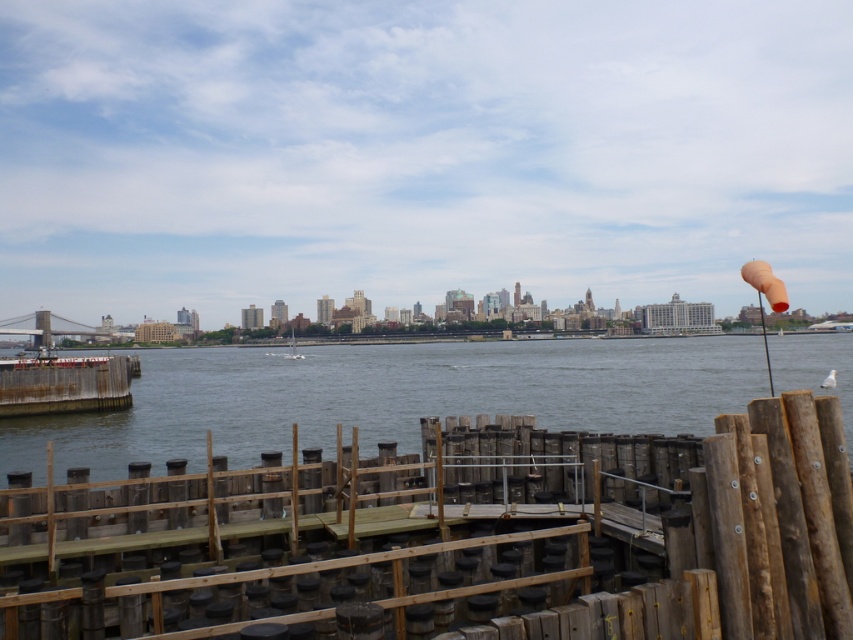
Question: Estimate the real-world distances between objects in this image. Which object is farther from the brown wooden fence at lower center?

Choices:
 (A) white matte sailboat at center
 (B) gray water at lower left

Answer: (A)

Question: Is the position of brown wooden fence at lower center less distant than that of gray water at lower left?

Choices:
 (A) no
 (B) yes

Answer: (B)

Question: Is gray water at lower left positioned behind white matte sailboat at center?

Choices:
 (A) yes
 (B) no

Answer: (B)

Question: Does gray water at lower left have a larger size compared to white matte sailboat at center?

Choices:
 (A) no
 (B) yes

Answer: (B)

Question: Among these points, which one is farthest from the camera?

Choices:
 (A) (717, 465)
 (B) (283, 353)
 (C) (585, 348)

Answer: (B)

Question: Which point appears farthest from the camera in this image?

Choices:
 (A) (635, 444)
 (B) (851, 442)

Answer: (A)